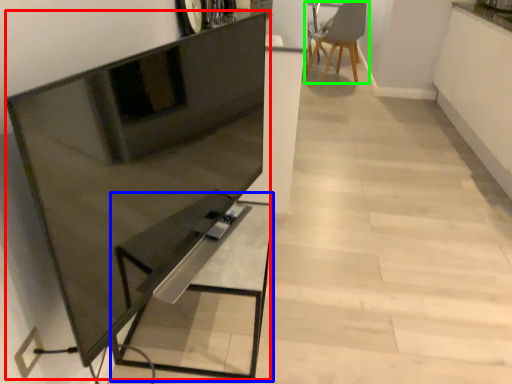
Question: Considering the real-world distances, which object is closest to entertainment center (highlighted by a red box)? table (highlighted by a blue box) or chair (highlighted by a green box).

Choices:
 (A) table
 (B) chair

Answer: (A)